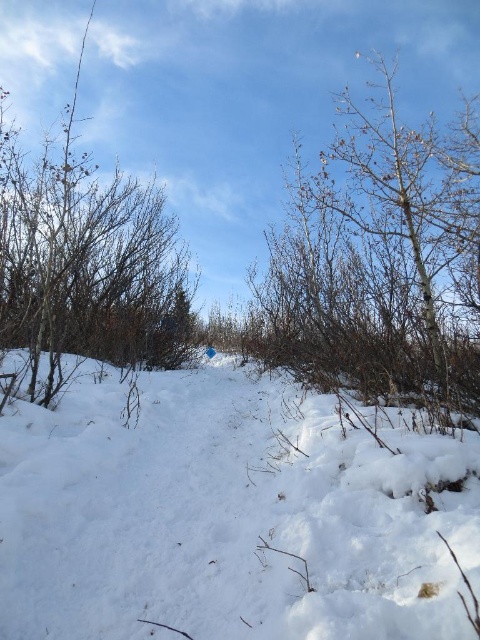
You are standing in the winter landscape and want to walk from the white fluffy snow at center to the bare branches at upper right. Which direction should you move to reach them?

To reach the bare branches at upper right from the white fluffy snow at center, you should move to the right since the bare branches at upper right are positioned to the right of the white fluffy snow at center.

You are standing in the winter landscape and want to walk from the point closer to you to the farther point. Which path would you take between the two points, point (232, 548) and point (26, 262)?

You should walk towards point (26, 262) because it is farther away from you compared to point (232, 548), which is closer. The path goes from the closer point to the farther one.